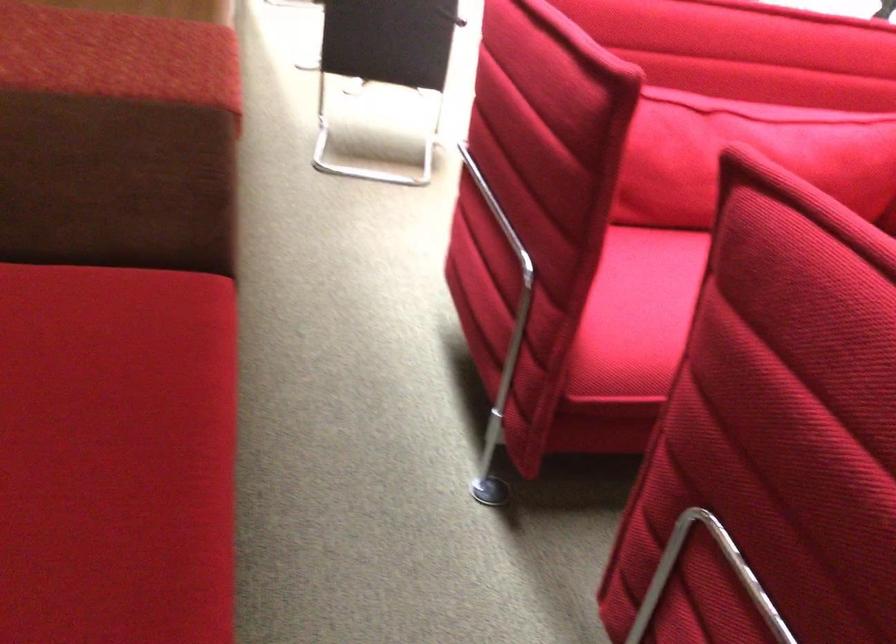
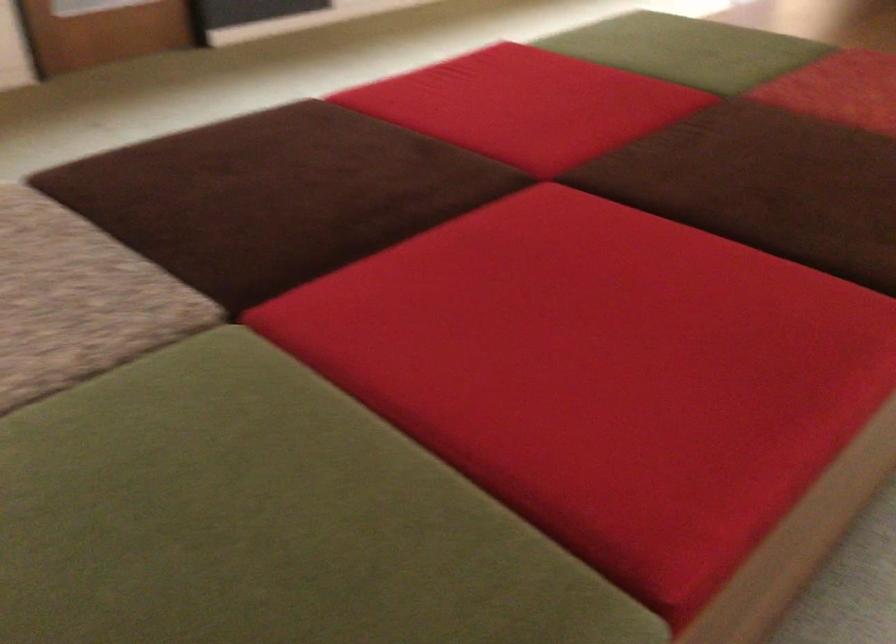
Question: The camera is either moving clockwise (left) or counter-clockwise (right) around the object. The first image is from the beginning of the video and the second image is from the end. Is the camera moving left or right when shooting the video?

Choices:
 (A) Left
 (B) Right

Answer: (B)